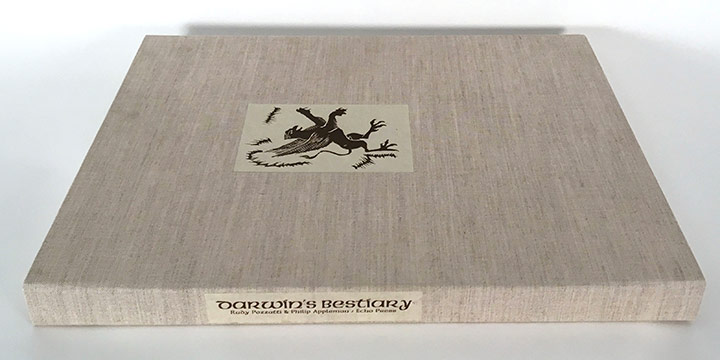
The width and height of the screenshot is (720, 360). Identify the location of book spine corners. (22, 285), (32, 321), (693, 314), (703, 280).